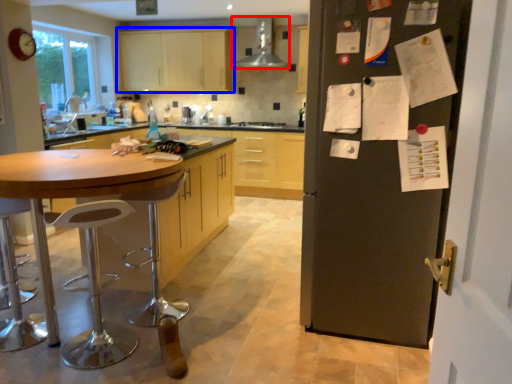
Question: Which object is closer to the camera taking this photo, kitchen appliance (highlighted by a red box) or cabinetry (highlighted by a blue box)?

Choices:
 (A) kitchen appliance
 (B) cabinetry

Answer: (A)